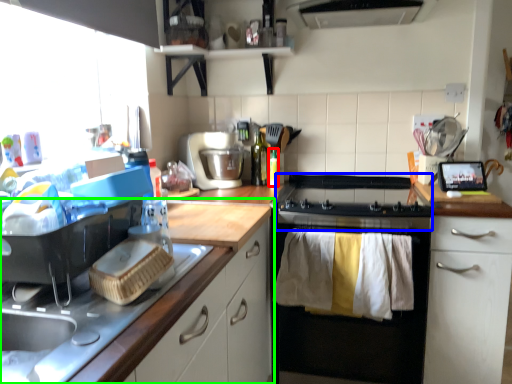
Question: Estimate the real-world distances between objects in this image. Which object is farther from bottle (highlighted by a red box), gas stove (highlighted by a blue box) or cabinetry (highlighted by a green box)?

Choices:
 (A) gas stove
 (B) cabinetry

Answer: (B)